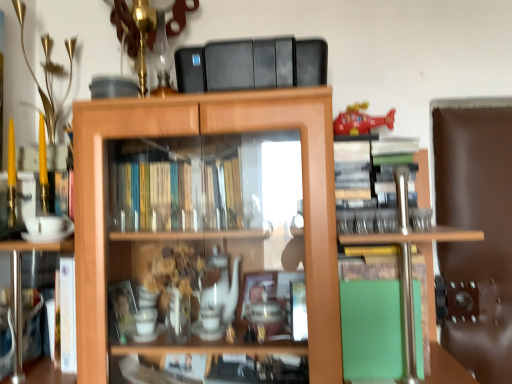
Question: Does green matte book at lower right, acting as the 2th book starting from the left, appear on the right side of wooden cabinet at center?

Choices:
 (A) yes
 (B) no

Answer: (A)

Question: Is green matte book at lower right, positioned as the 1th book in right-to-left order, further to the viewer compared to wooden cabinet at center?

Choices:
 (A) yes
 (B) no

Answer: (A)

Question: Considering the relative sizes of green matte book at lower right, positioned as the 1th book in right-to-left order, and wooden cabinet at center in the image provided, is green matte book at lower right, positioned as the 1th book in right-to-left order, smaller than wooden cabinet at center?

Choices:
 (A) no
 (B) yes

Answer: (B)

Question: From the image's perspective, is green matte book at lower right, acting as the 2th book starting from the left, on top of wooden cabinet at center?

Choices:
 (A) yes
 (B) no

Answer: (B)

Question: Can you confirm if green matte book at lower right, positioned as the 1th book in right-to-left order, is shorter than wooden cabinet at center?

Choices:
 (A) yes
 (B) no

Answer: (A)

Question: Is green matte book at lower right, acting as the 2th book starting from the left, positioned before wooden cabinet at center?

Choices:
 (A) yes
 (B) no

Answer: (B)

Question: Can you confirm if green matte book at lower left, marked as the 2th book in a right-to-left arrangement, is smaller than wooden cabinet at center?

Choices:
 (A) no
 (B) yes

Answer: (B)

Question: Does green matte book at lower left, marked as the 2th book in a right-to-left arrangement, appear on the left side of wooden cabinet at center?

Choices:
 (A) yes
 (B) no

Answer: (A)

Question: From a real-world perspective, is green matte book at lower left, placed as the first book when sorted from left to right, physically below wooden cabinet at center?

Choices:
 (A) yes
 (B) no

Answer: (A)

Question: Is green matte book at lower left, placed as the first book when sorted from left to right, positioned behind wooden cabinet at center?

Choices:
 (A) yes
 (B) no

Answer: (A)

Question: Could you tell me if green matte book at lower left, placed as the first book when sorted from left to right, is facing wooden cabinet at center?

Choices:
 (A) no
 (B) yes

Answer: (B)

Question: From the image's perspective, is green matte book at lower left, marked as the 2th book in a right-to-left arrangement, beneath wooden cabinet at center?

Choices:
 (A) yes
 (B) no

Answer: (A)

Question: Considering the relative sizes of green matte book at lower left, marked as the 2th book in a right-to-left arrangement, and shiny plastic helicopter at upper right in the image provided, is green matte book at lower left, marked as the 2th book in a right-to-left arrangement, smaller than shiny plastic helicopter at upper right?

Choices:
 (A) no
 (B) yes

Answer: (A)